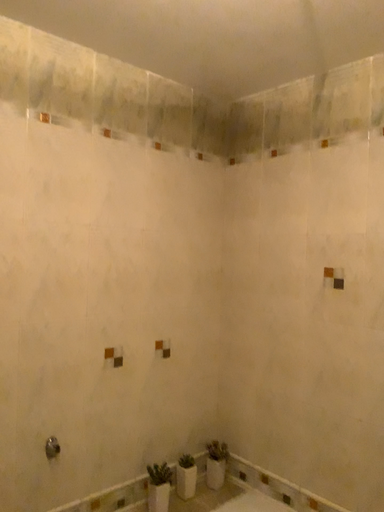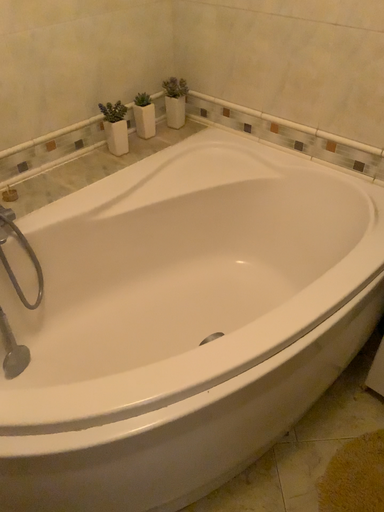
Question: How did the camera likely rotate when shooting the video?

Choices:
 (A) rotated downward
 (B) rotated upward

Answer: (A)